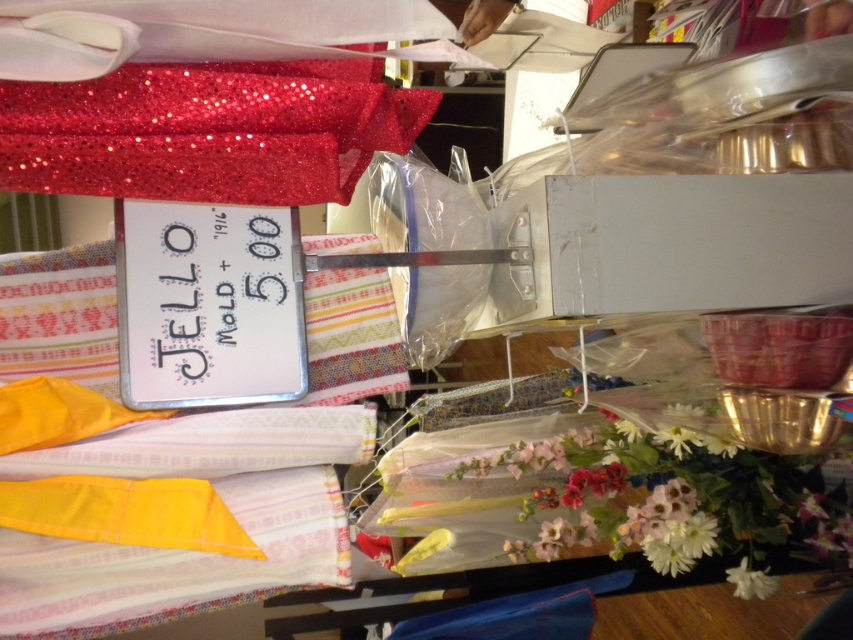
You are a customer at the market stall and want to locate the glittery red fabric at upper left. Based on the scene description, where exactly is it positioned relative to the other items?

The glittery red fabric at upper left is located at point coordinates of (202, 134). This means it is positioned near the top left corner of the scene, above and to the left of the other items like the sign and the colorful striped fabrics.

You are a customer at the market stall and want to buy both the white matte flower at lower right and the white fabric flower at lower right. When you look closely, which one appears closer to you?

The white matte flower at lower right is in front of the white fabric flower at lower right, so it appears closer to you.

You are a photographer holding a camera and want to capture the glittery red fabric at upper left without any obstructions. Given that you and the camera are currently positioned 26.20 inches away from the fabric, is there enough space to move closer to get a better shot?

The glittery red fabric at upper left and the camera are 26.20 inches apart. Since you are already 26.20 inches away from the fabric, moving closer would require reducing this distance, but there is no information provided about any obstacles between you and the fabric. Assuming there are no obstructions, you can move closer to get a better shot.